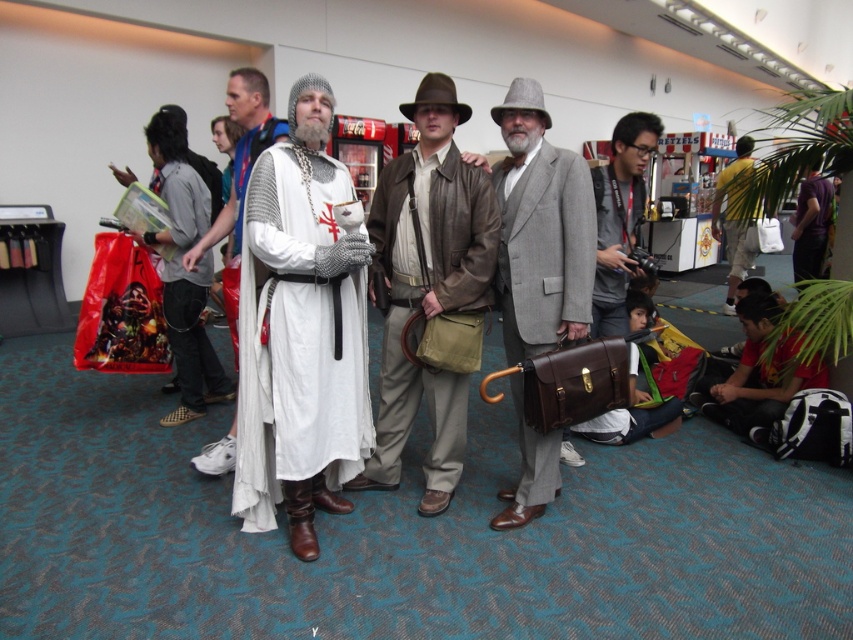
You are organizing a photo shoot and want to place the gray wool suit at center and the purple fabric shirt at right in a way that maintains their size relationship. Which object should be placed closer to the camera to achieve this?

To maintain the size relationship where the gray wool suit at center is smaller than the purple fabric shirt at right, the gray wool suit at center should be placed farther from the camera compared to the purple fabric shirt at right. This way, the purple fabric shirt at right appears larger when closer, matching their described sizes.